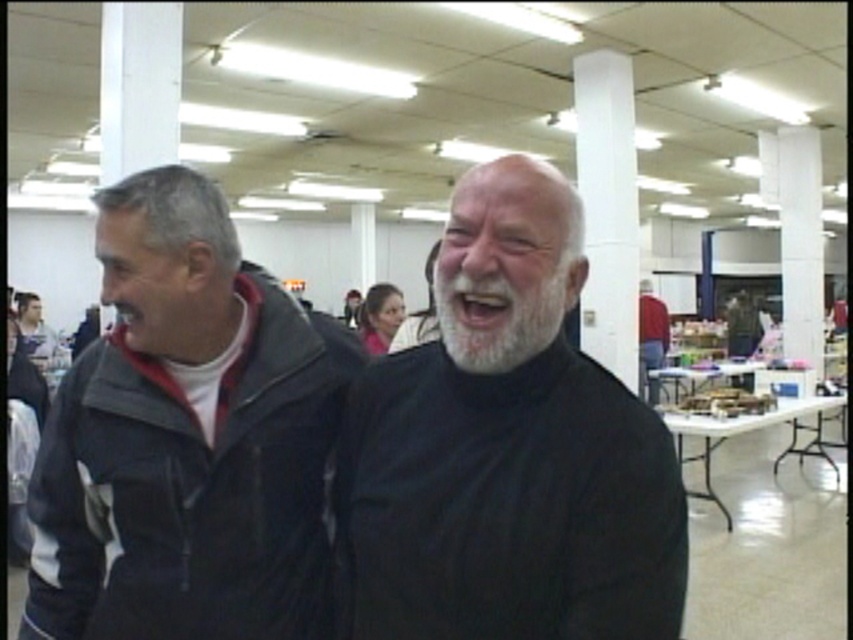
The width and height of the screenshot is (853, 640). What do you see at coordinates (506, 451) in the screenshot? I see `white matte beard at center` at bounding box center [506, 451].

Is point (590, 520) more distant than point (173, 630)?

No, (590, 520) is in front of (173, 630).

Image resolution: width=853 pixels, height=640 pixels. What are the coordinates of `white matte beard at center` in the screenshot? It's located at (506, 451).

Is dark gray jacket at left to the left of white fuzzy beard at center from the viewer's perspective?

Indeed, dark gray jacket at left is positioned on the left side of white fuzzy beard at center.

Can you confirm if dark gray jacket at left is shorter than white fuzzy beard at center?

No, dark gray jacket at left is not shorter than white fuzzy beard at center.

Is point (207, 422) positioned in front of point (453, 282)?

No, (207, 422) is further to viewer.

At what (x,y) coordinates should I click in order to perform the action: click on dark gray jacket at left. Please return your answer as a coordinate pair (x, y). Image resolution: width=853 pixels, height=640 pixels. Looking at the image, I should click on (187, 438).

Does white matte beard at center appear on the right side of red sweater at center?

Incorrect, white matte beard at center is not on the right side of red sweater at center.

Which is in front, point (445, 440) or point (641, 364)?

Point (445, 440) is more forward.

At what (x,y) coordinates should I click in order to perform the action: click on white matte beard at center. Please return your answer as a coordinate pair (x, y). This screenshot has height=640, width=853. Looking at the image, I should click on tap(506, 451).